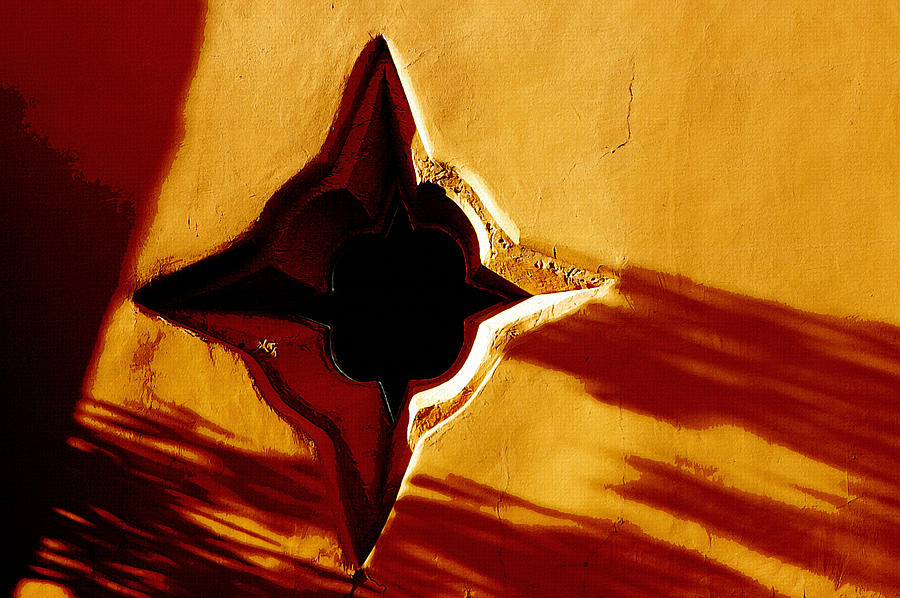
Locate an element on the screen. The width and height of the screenshot is (900, 598). wall is located at coordinates click(799, 164).